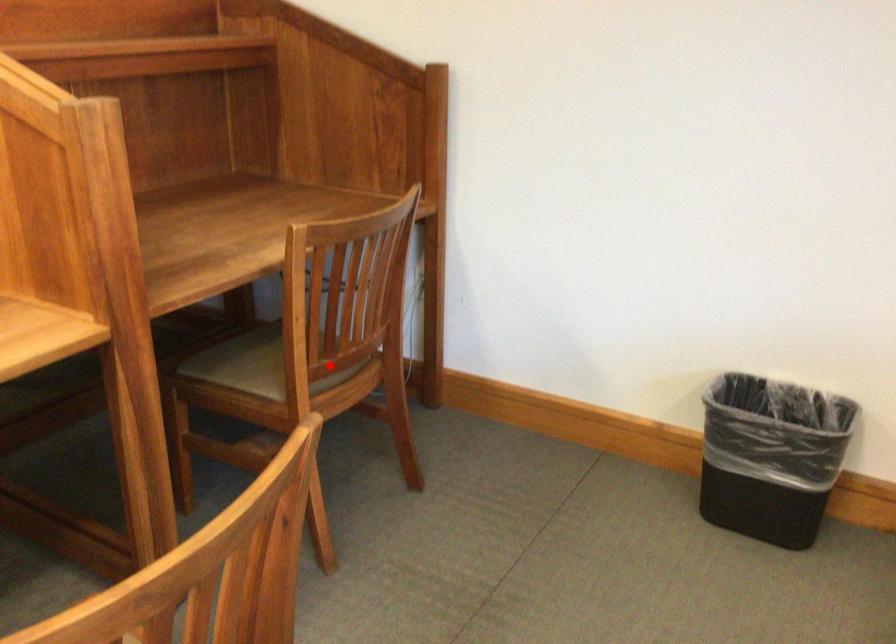
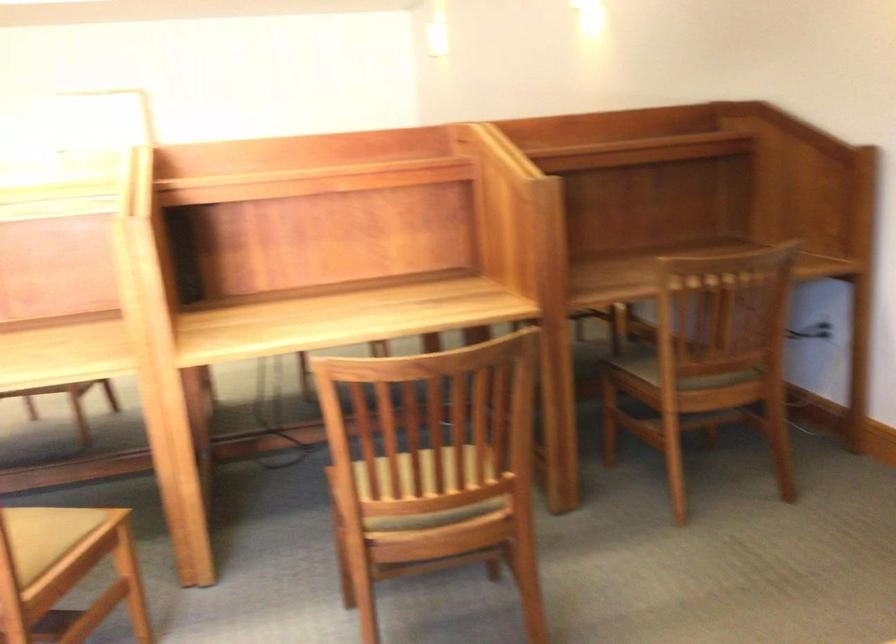
Question: I am providing you with two images of the same scene from different viewpoints. In image1, a red point is highlighted. Considering the same 3D point in image2, which of the following is correct?

Choices:
 (A) It is closer
 (B) It is farther

Answer: (B)